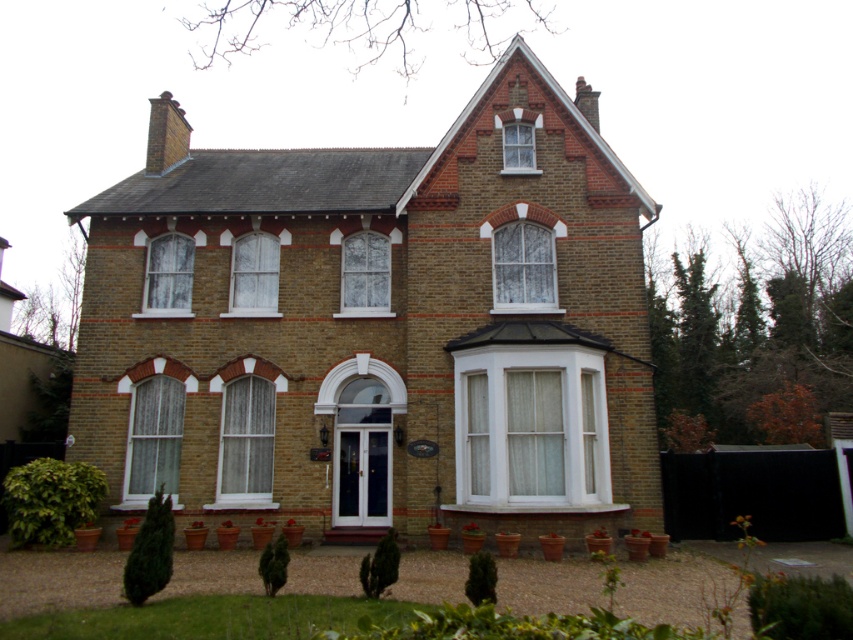
Does white textured glass at upper center have a lesser height compared to white glass window at center?

Yes, white textured glass at upper center is shorter than white glass window at center.

Can you confirm if white textured glass at upper center is positioned to the right of white glass window at center?

Correct, you'll find white textured glass at upper center to the right of white glass window at center.

Which is behind, point (531, 300) or point (256, 301)?

Point (256, 301)

The width and height of the screenshot is (853, 640). I want to click on white textured glass at upper center, so click(x=523, y=266).

This screenshot has height=640, width=853. Find the location of `white glass window at center`. white glass window at center is located at coordinates [x=254, y=276].

Who is shorter, white glass window at center or white textured glass at upper left?

white glass window at center

Who is more distant from viewer, (229, 298) or (171, 314)?

The point (229, 298) is more distant.

I want to click on white glass window at center, so click(254, 276).

Can you confirm if clear glass window at center is positioned above white glass window at center?

Indeed, clear glass window at center is positioned over white glass window at center.

In the scene shown: Does clear glass window at center appear on the right side of white glass window at center?

Yes, clear glass window at center is to the right of white glass window at center.

You are a GUI agent. You are given a task and a screenshot of the screen. Output one action in this format:
    pyautogui.click(x=<x>, y=<y>)
    Task: Click on the clear glass window at center
    The width and height of the screenshot is (853, 640).
    Given the screenshot: What is the action you would take?
    pyautogui.click(x=364, y=275)